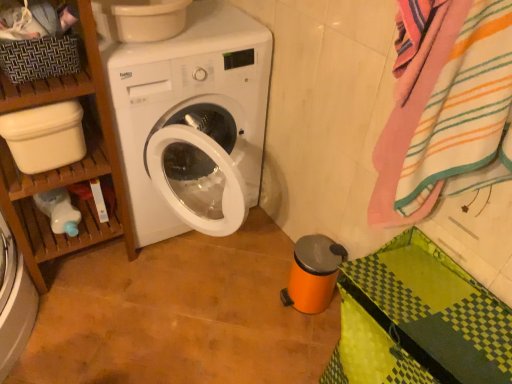
Question: From the image's perspective, is striped cotton bath towel at right under wooden shelf at left?

Choices:
 (A) no
 (B) yes

Answer: (A)

Question: Considering the relative sizes of striped cotton bath towel at right and wooden shelf at left in the image provided, is striped cotton bath towel at right shorter than wooden shelf at left?

Choices:
 (A) yes
 (B) no

Answer: (A)

Question: Can we say striped cotton bath towel at right lies outside wooden shelf at left?

Choices:
 (A) yes
 (B) no

Answer: (A)

Question: From the image's perspective, would you say striped cotton bath towel at right is positioned over wooden shelf at left?

Choices:
 (A) yes
 (B) no

Answer: (A)

Question: Would you say wooden shelf at left is part of striped cotton bath towel at right's contents?

Choices:
 (A) yes
 (B) no

Answer: (B)

Question: Is striped cotton bath towel at right thinner than wooden shelf at left?

Choices:
 (A) no
 (B) yes

Answer: (B)

Question: From the image's perspective, is wooden shelf at left on top of striped cotton bath towel at right?

Choices:
 (A) no
 (B) yes

Answer: (A)

Question: Is wooden shelf at left positioned with its back to striped cotton bath towel at right?

Choices:
 (A) no
 (B) yes

Answer: (A)

Question: Considering the relative sizes of wooden shelf at left and striped cotton bath towel at right in the image provided, is wooden shelf at left wider than striped cotton bath towel at right?

Choices:
 (A) yes
 (B) no

Answer: (A)

Question: From a real-world perspective, is wooden shelf at left located beneath striped cotton bath towel at right?

Choices:
 (A) yes
 (B) no

Answer: (A)

Question: Considering the relative sizes of wooden shelf at left and striped cotton bath towel at right in the image provided, is wooden shelf at left shorter than striped cotton bath towel at right?

Choices:
 (A) yes
 (B) no

Answer: (B)

Question: Is striped cotton bath towel at right a part of wooden shelf at left?

Choices:
 (A) no
 (B) yes

Answer: (A)

Question: Does wooden shelf at left have a smaller size compared to woven brown basket at upper left?

Choices:
 (A) yes
 (B) no

Answer: (B)